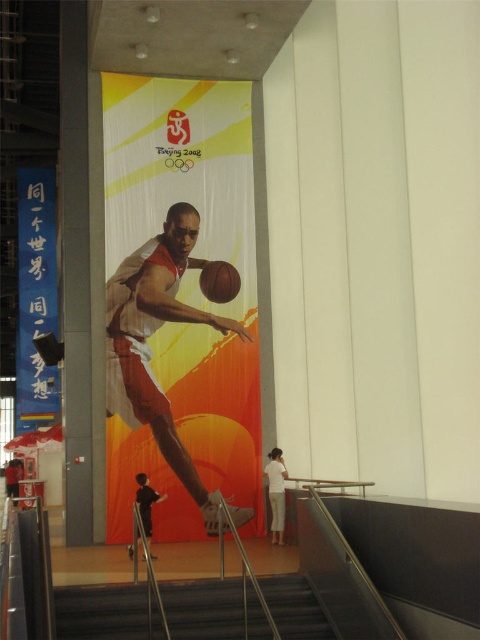
Question: Is dark gray concrete stairs at lower center below matte white banner at upper center?

Choices:
 (A) no
 (B) yes

Answer: (B)

Question: Is dark gray concrete stairs at lower center thinner than rubber/leather basketball at center?

Choices:
 (A) no
 (B) yes

Answer: (A)

Question: Which object is positioned farthest from the dark gray concrete stairs at lower center?

Choices:
 (A) rubber/leather basketball at center
 (B) matte white banner at upper center

Answer: (B)

Question: Can you confirm if matte white basketball player at center is positioned below dark gray concrete stairs at lower center?

Choices:
 (A) yes
 (B) no

Answer: (B)

Question: Which of these objects is positioned closest to the dark gray concrete stairs at lower center?

Choices:
 (A) matte white basketball player at center
 (B) matte white banner at upper center
 (C) rubber/leather basketball at center

Answer: (A)

Question: Which of these objects is positioned farthest from the rubber/leather basketball at center?

Choices:
 (A) matte white basketball player at center
 (B) matte white banner at upper center
 (C) dark gray concrete stairs at lower center

Answer: (B)